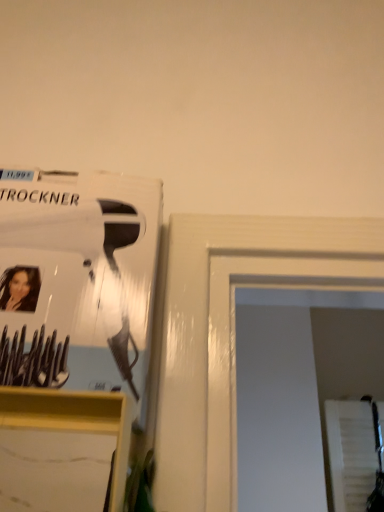
Image resolution: width=384 pixels, height=512 pixels. What do you see at coordinates (78, 281) in the screenshot?
I see `white plastic hair dryer at left` at bounding box center [78, 281].

In order to click on white plastic hair dryer at left in this screenshot , I will do `click(78, 281)`.

I want to click on white plastic hair dryer at left, so click(x=78, y=281).